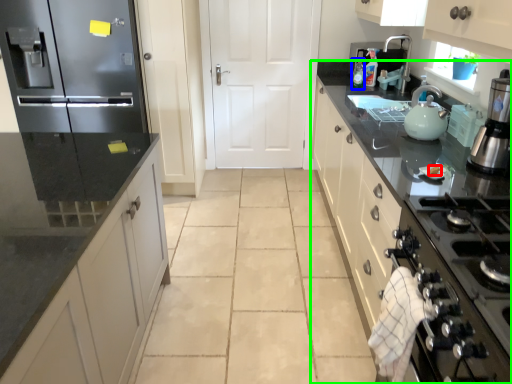
Question: Which object is positioned closest to food (highlighted by a red box)? Select from bottle (highlighted by a blue box) and countertop (highlighted by a green box).

Choices:
 (A) bottle
 (B) countertop

Answer: (B)